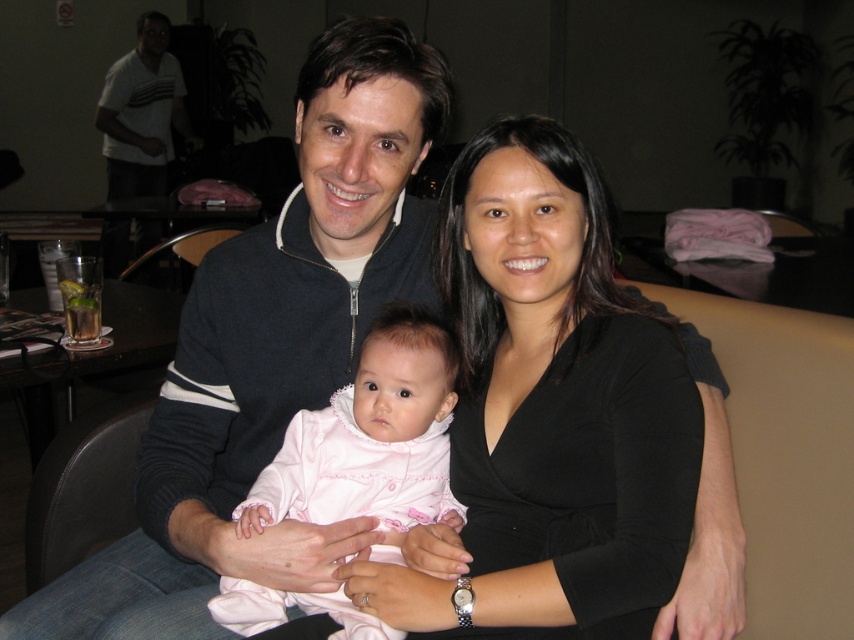
Can you confirm if pink soft fabric baby at center is positioned to the left of white striped t-shirt at upper left?

Incorrect, pink soft fabric baby at center is not on the left side of white striped t-shirt at upper left.

Is point (414, 419) closer to viewer compared to point (104, 77)?

Yes, it is.

In order to click on pink soft fabric baby at center in this screenshot , I will do `click(371, 442)`.

Who is taller, black matte shirt at center or pink soft fabric baby at center?

Standing taller between the two is black matte shirt at center.

What do you see at coordinates (551, 410) in the screenshot? The height and width of the screenshot is (640, 854). I see `black matte shirt at center` at bounding box center [551, 410].

Between point (586, 204) and point (431, 518), which one is positioned in front?

Point (586, 204) is in front.

This screenshot has height=640, width=854. Find the location of `black matte shirt at center`. black matte shirt at center is located at coordinates (551, 410).

Where is `black matte shirt at center`? black matte shirt at center is located at coordinates (551, 410).

Does black matte shirt at center have a greater width compared to white striped t-shirt at upper left?

Yes.

Find the location of a particular element. black matte shirt at center is located at coordinates (551, 410).